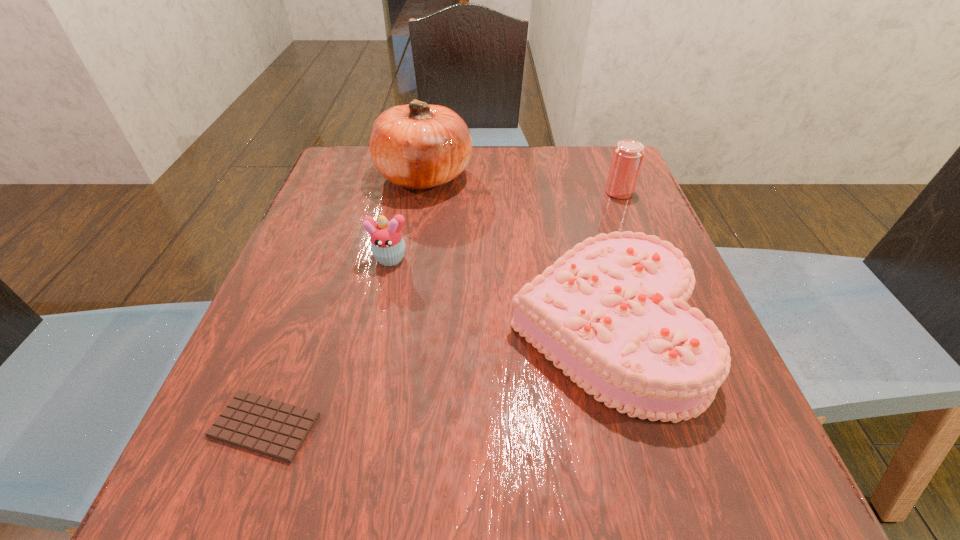
Where is `object situated at the far right corner`? The width and height of the screenshot is (960, 540). object situated at the far right corner is located at coordinates (628, 154).

This screenshot has height=540, width=960. In order to click on vacant area at the far edge of the desktop in this screenshot , I will do `click(549, 188)`.

This screenshot has height=540, width=960. In the image, there is a desktop. Identify the location of blank space at the near edge. (492, 466).

Where is `vacant space at the left edge of the desktop`? This screenshot has height=540, width=960. vacant space at the left edge of the desktop is located at coordinates (358, 211).

In the image, there is a desktop. Find the location of `vacant space at the far left corner`. vacant space at the far left corner is located at coordinates (351, 145).

In the image, there is a desktop. Where is `vacant space at the near left corner`? vacant space at the near left corner is located at coordinates (237, 473).

Where is `vacant region at the far right corner of the desktop`? Image resolution: width=960 pixels, height=540 pixels. vacant region at the far right corner of the desktop is located at coordinates click(x=570, y=178).

Where is `free spot at the near right corner of the desktop`? This screenshot has width=960, height=540. free spot at the near right corner of the desktop is located at coordinates (685, 503).

Find the location of a particular element. vacant point located between the tallest object and the cake is located at coordinates (514, 252).

The height and width of the screenshot is (540, 960). Identify the location of blank region between the chocolate bar and the cupcake. (327, 342).